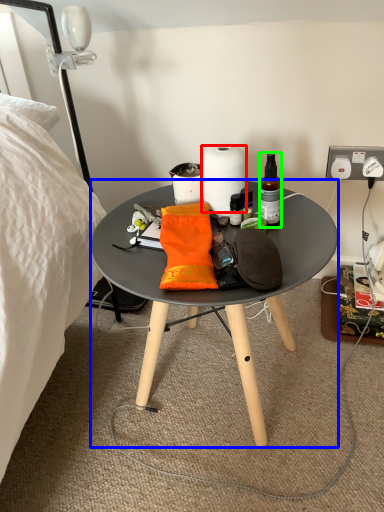
Question: Based on their relative distances, which object is farther from paper towel (highlighted by a red box)? Choose from coffee table (highlighted by a blue box) and bottle (highlighted by a green box).

Choices:
 (A) coffee table
 (B) bottle

Answer: (A)